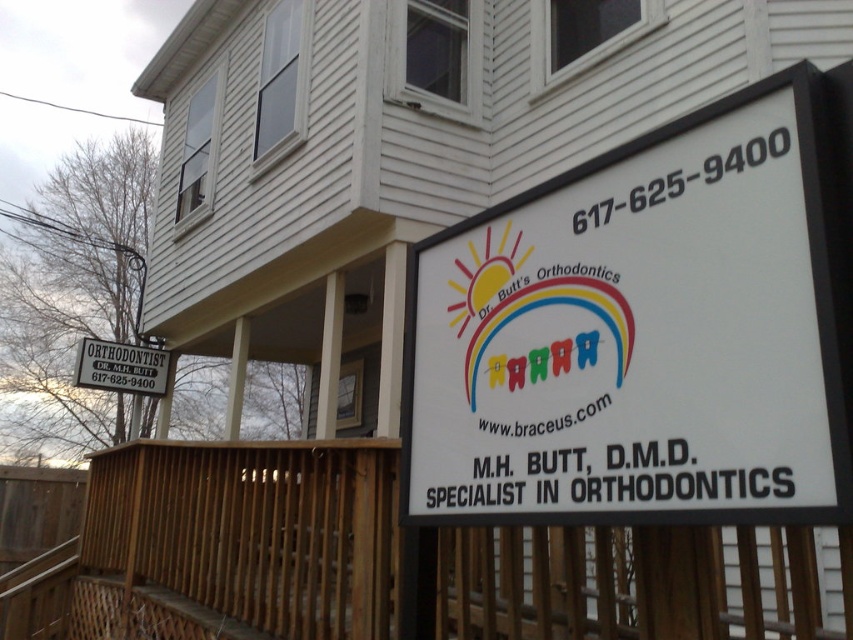
You are standing at the entrance of Dr. Butt Orthodontics. You want to place a new sign that is 0.3 meters wide. The existing white plastic sign at right is located at point (647, 330). Can you place your new sign 0.2 meters to the right of the existing white plastic sign at right without overlapping?

The white plastic sign at right is located at point (647, 330). Since the new sign is 0.3 meters wide and needs to be placed 0.2 meters to the right of the existing sign, there will be an overlap of 0.1 meters. Therefore, you cannot place the new sign without overlapping.

You are a customer approaching the entrance of Dr. Butt Orthodontics. You see the white plastic sign at right and the wooden at lower center. Which object is closer to you as you approach the entrance?

The white plastic sign at right is closer to the viewer than the wooden at lower center, so the white plastic sign at right is closer to you as you approach the entrance.